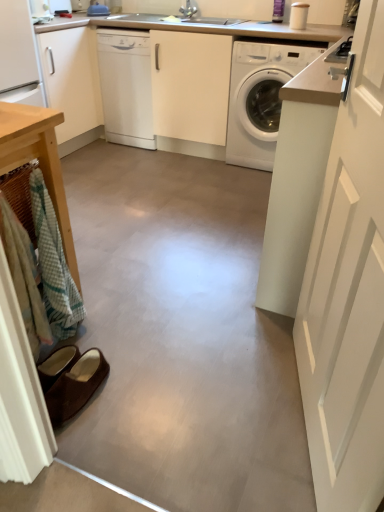
At what (x,y) coordinates should I click in order to perform the action: click on vacant space situated on the left part of white matte door at right. Please return your answer as a coordinate pair (x, y). This screenshot has height=512, width=384. Looking at the image, I should click on (204, 401).